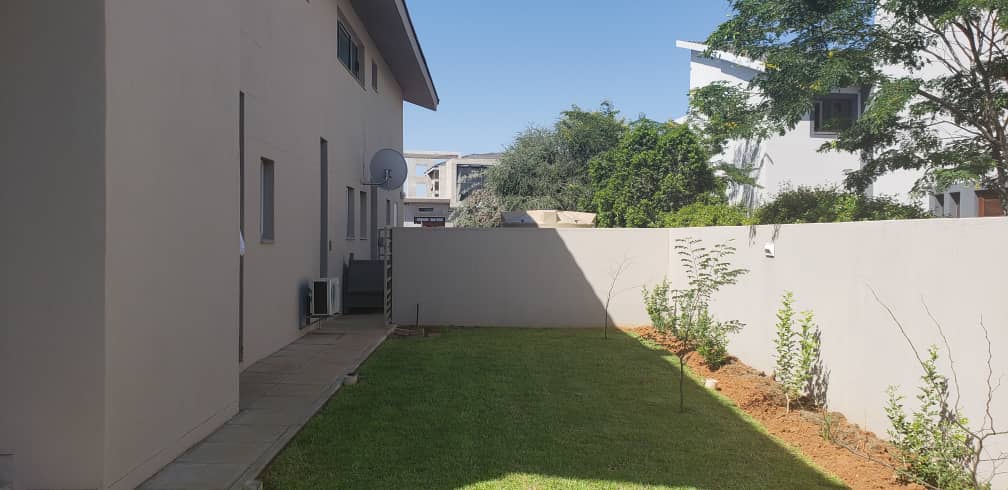
Locate an element on the screen. air conditioner is located at coordinates (330, 299).